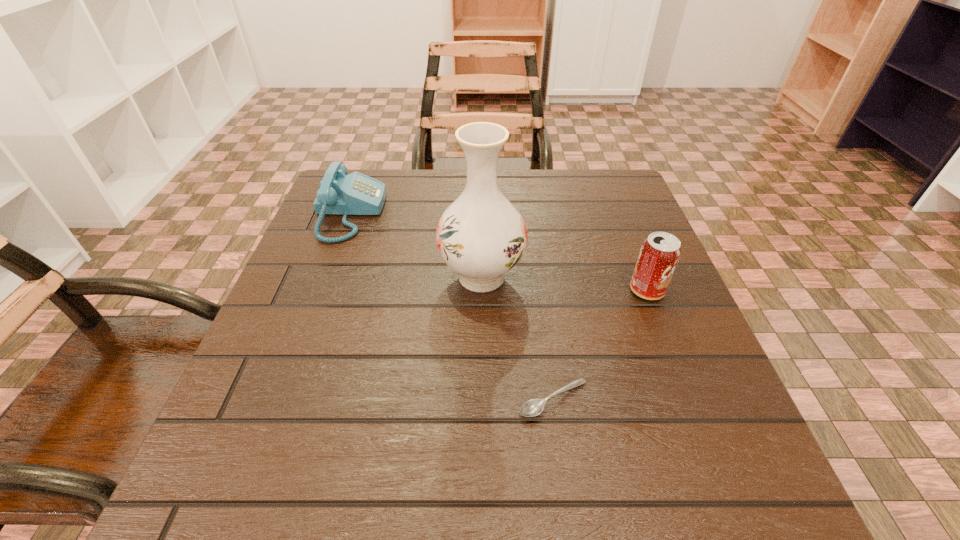
Identify the location of the tallest object. The width and height of the screenshot is (960, 540). (481, 235).

I want to click on the rightmost object, so click(659, 255).

Locate an element on the screen. The height and width of the screenshot is (540, 960). the third shortest object is located at coordinates (659, 255).

You are a GUI agent. You are given a task and a screenshot of the screen. Output one action in this format:
    pyautogui.click(x=<x>, y=<y>)
    Task: Click on the farthest object
    Image resolution: width=960 pixels, height=540 pixels.
    Given the screenshot: What is the action you would take?
    pyautogui.click(x=339, y=193)

I want to click on the third tallest object, so click(x=339, y=193).

The height and width of the screenshot is (540, 960). I want to click on the shortest object, so click(533, 407).

The height and width of the screenshot is (540, 960). In order to click on the nearest object in this screenshot , I will do `click(533, 407)`.

In order to click on free region located 0.120m on the back of the vase in this screenshot , I will do `click(481, 217)`.

Locate an element on the screen. This screenshot has width=960, height=540. free space located on the left of the second tallest object is located at coordinates (472, 291).

Where is `vacant region located on the dial of the telephone`? The height and width of the screenshot is (540, 960). vacant region located on the dial of the telephone is located at coordinates (536, 214).